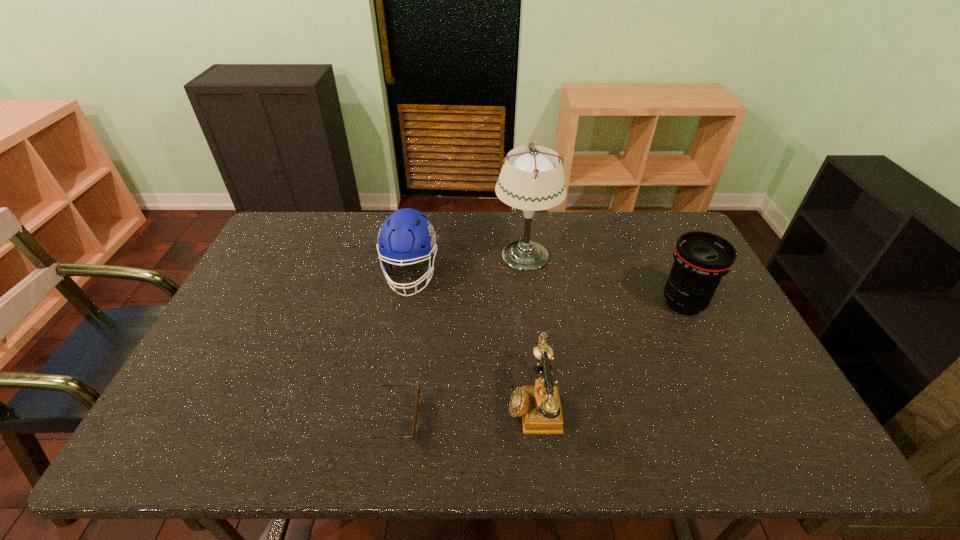
Find the location of `lampshade`. lampshade is located at coordinates (532, 178).

Identify the location of football helmet. This screenshot has height=540, width=960. (406, 236).

Where is `telephoto lens`? telephoto lens is located at coordinates (701, 259).

This screenshot has height=540, width=960. In order to click on the fourth tallest object in this screenshot , I will do coord(539,406).

You are a GUI agent. You are given a task and a screenshot of the screen. Output one action in this format:
    pyautogui.click(x=<x>, y=<y>)
    Task: Click on the shortest object
    
    Given the screenshot: What is the action you would take?
    pyautogui.click(x=414, y=431)

Where is `vacant space located 0.300m on the lampshade of the lampshade`? This screenshot has width=960, height=540. vacant space located 0.300m on the lampshade of the lampshade is located at coordinates point(402,255).

At what (x,y) coordinates should I click in order to perform the action: click on free spot located on the lampshade of the lampshade. Please return your answer as a coordinate pair (x, y). This screenshot has height=540, width=960. Looking at the image, I should click on (384, 255).

Identify the location of vacant space positioned on the lampshade of the lampshade. (464, 255).

Where is `vacant area situated 0.250m on the face guard of the football helmet`? The width and height of the screenshot is (960, 540). vacant area situated 0.250m on the face guard of the football helmet is located at coordinates (394, 373).

This screenshot has height=540, width=960. Find the location of `vacant space located on the front of the rightmost object`. vacant space located on the front of the rightmost object is located at coordinates (735, 411).